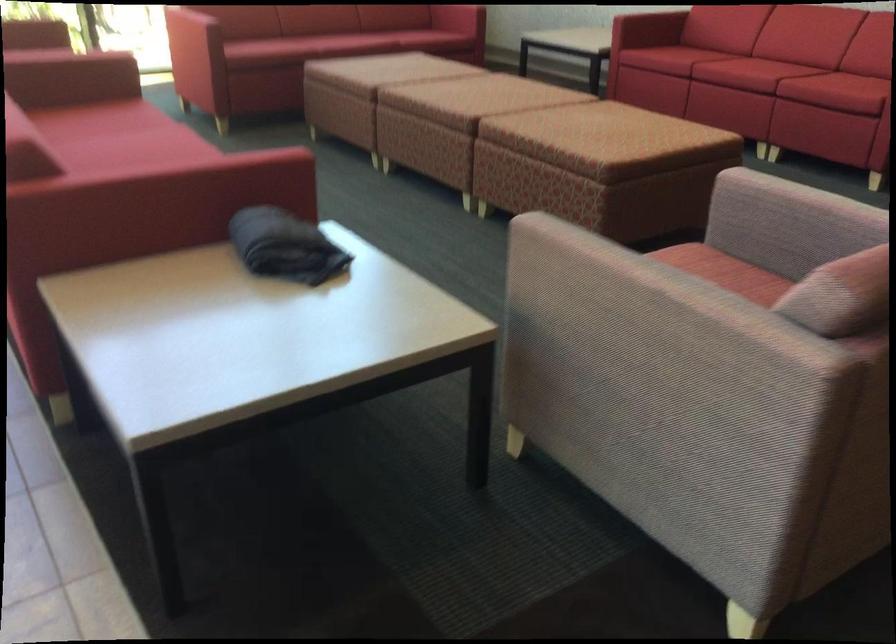
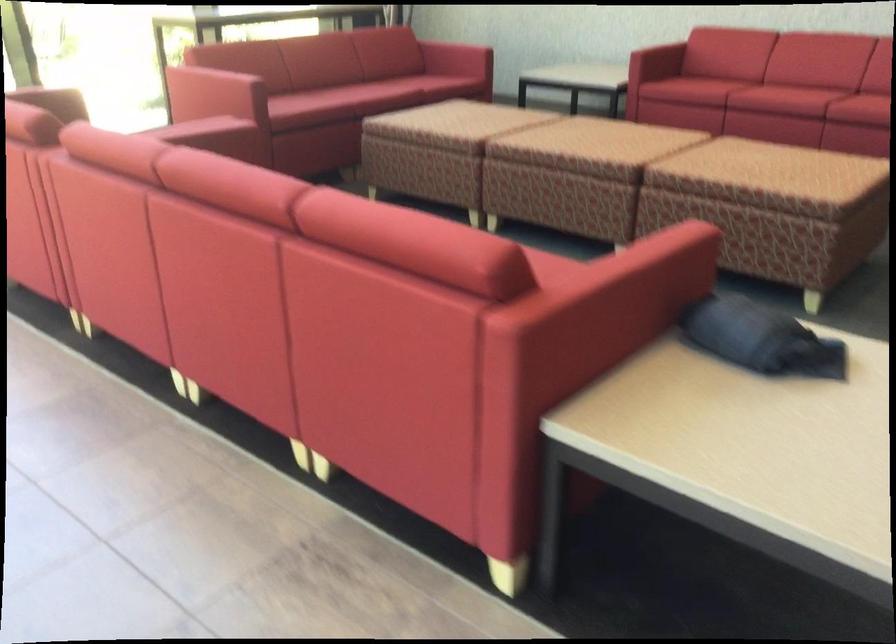
The first image is from the beginning of the video and the second image is from the end. How did the camera likely rotate when shooting the video?

The camera's rotation is toward right-down.